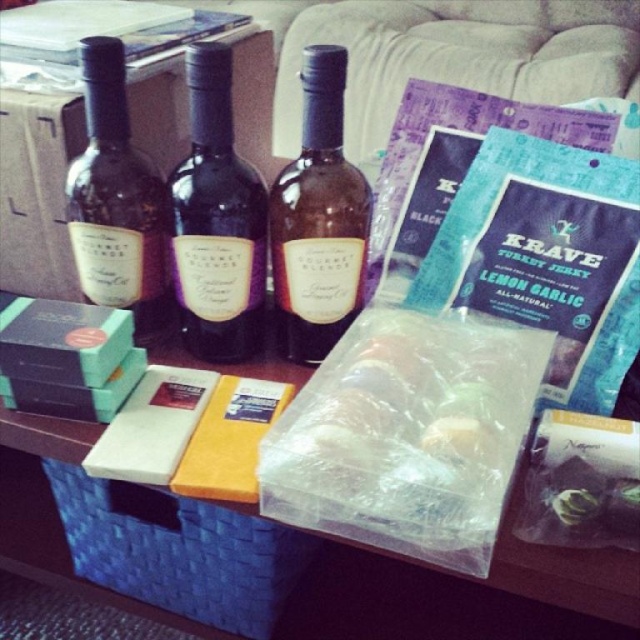
You are a delivery person trying to place a small package on the dark wooden surface in the living room. The package must be placed exactly at the point marked as point (344, 195). If the camera is positioned 24 inches away from the surface, will the package land precisely at that point when dropped from the current camera position?

The distance of point (344, 195) from the camera is 22.02 inches, which is less than the 24 inches distance of the camera from the surface. Therefore, dropping the package from the camera position would overshoot the target point and land beyond it.

You are organizing items on a dark wooden table in a living room. You have a brown glass bottle at center. Where should you place it to match the image?

The brown glass bottle at center should be placed at point (317, 220) to match the image.

You are organizing a dinner party and need to choose a bottle for a presentation. The brown glass bottle at center and the matte black wine bottle at left are both candidates. Which one should you pick if you want the larger bottle to be the focal point?

The brown glass bottle at center is bigger than the matte black wine bottle at left, so you should choose the brown glass bottle at center to be the focal point.